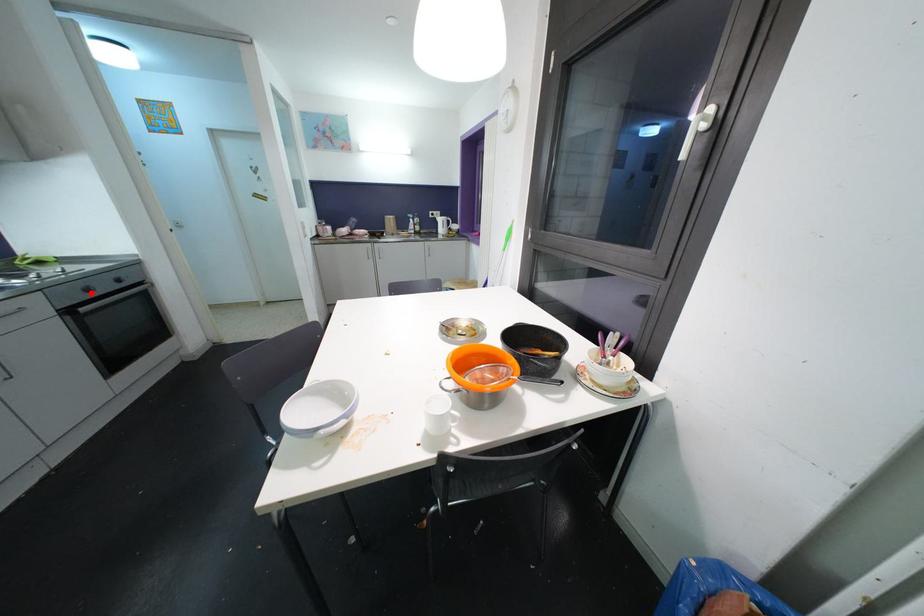
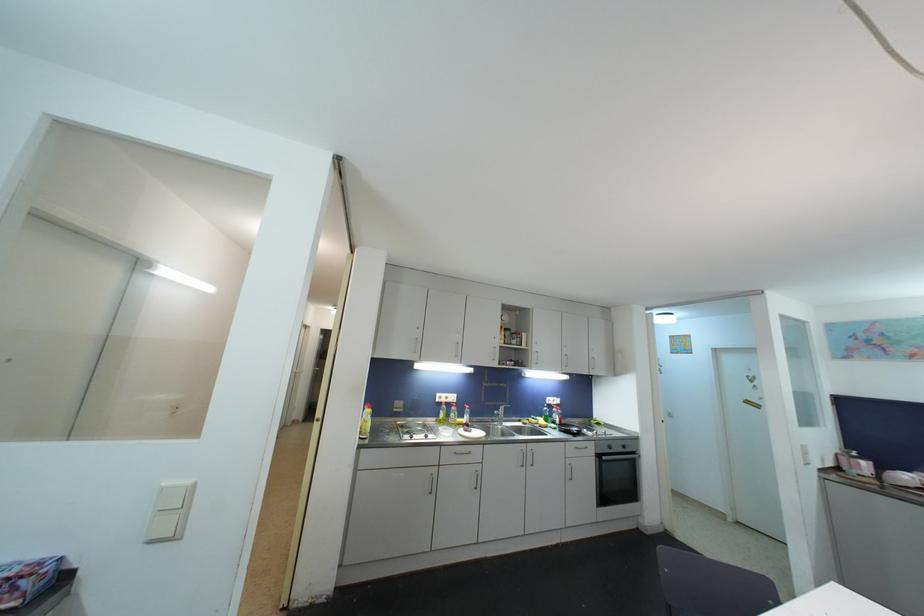
In the second image, find the point that corresponds to the highlighted location in the first image.

(613, 450)